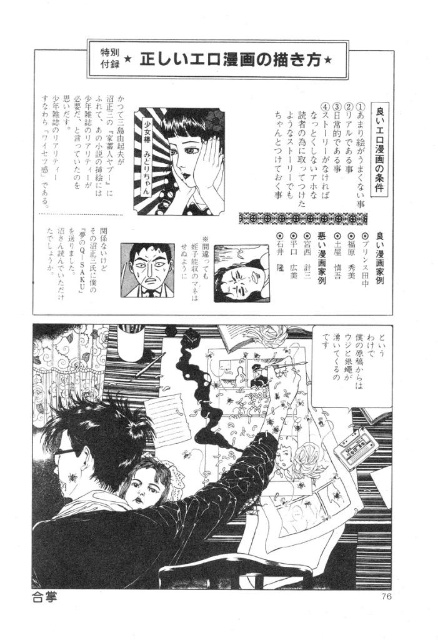
You are an artist holding a 12 inch ruler. You want to measure the distance between yourself and the black glossy hair at center in the manga image. How many rulers would you need to stack vertically to reach that distance?

The black glossy hair at center is 35.36 inches away from the viewer. Since each ruler is 12 inches long, you would need approximately 3 rulers stacked vertically to reach the distance of 35.36 inches.

You are a photographer standing in front of the matte black face at center. You want to take a closeup shot using a camera with a focal length of 50mm. The recommended distance for such shots is between 70cm to 100cm. Is your current position suitable for taking the photo?

The matte black face at center and camera are 92.67 centimeters apart, which falls within the recommended distance range of 70cm to 100cm. Therefore, your current position is suitable for taking the closeup shot.